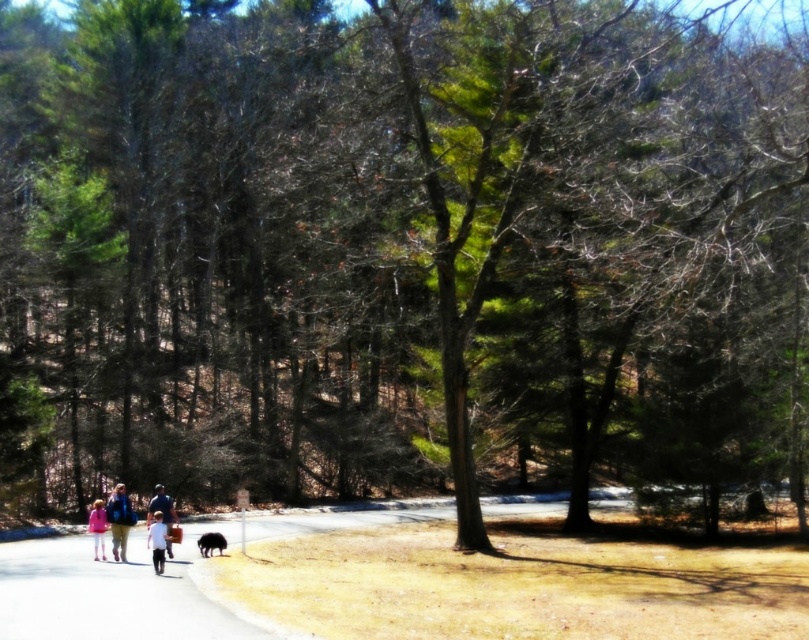
Question: Which point appears farthest from the camera in this image?

Choices:
 (A) (176, 513)
 (B) (112, 554)
 (C) (100, 520)
 (D) (163, 561)

Answer: (A)

Question: Which point appears closest to the camera in this image?

Choices:
 (A) (172, 516)
 (B) (102, 524)
 (C) (126, 518)
 (D) (210, 538)

Answer: (C)

Question: Is white cotton shirt at center bigger than black fur dog at center?

Choices:
 (A) no
 (B) yes

Answer: (B)

Question: Can you confirm if white cotton shirt at center is positioned above pink fabric at lower left?

Choices:
 (A) no
 (B) yes

Answer: (B)

Question: Which point is closer to the camera?

Choices:
 (A) (172, 524)
 (B) (166, 525)
 (C) (87, 529)
 (D) (201, 534)

Answer: (B)

Question: Is blue denim jacket at lower left below white cotton shirt at center?

Choices:
 (A) no
 (B) yes

Answer: (A)